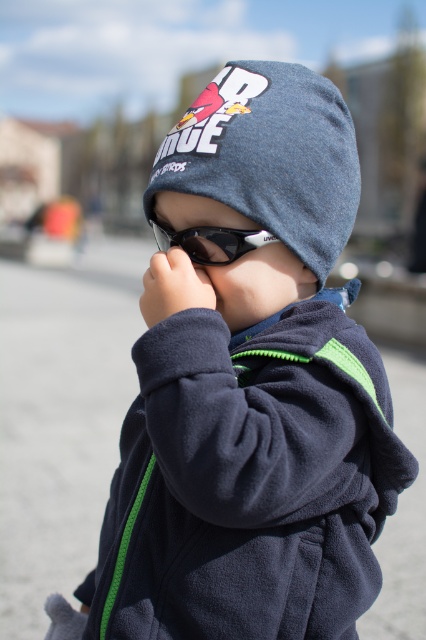
Based on the photo, the child is holding a pair of black sunglasses with white frames. The denim knit beanie at center is 1.25 meters away from the sunglasses. Can the child reach the beanie without moving their hand?

The denim knit beanie at center is 1.25 meters away from the sunglasses. Since the child is holding the sunglasses, they would need to extend their arm fully to reach 1.25 meters, which is possible but may require stretching.

You are a photographer standing 1.5 meters away from the subject. You want to capture a closeup shot of the denim knit beanie at center. Can you adjust your position to get the shot without moving the subject?

The denim knit beanie at center is 1.25 meters away from the camera. Since you are currently 1.5 meters away from the subject, you need to move 0.25 meters closer to the beanie to achieve the desired closeup shot without moving the subject.